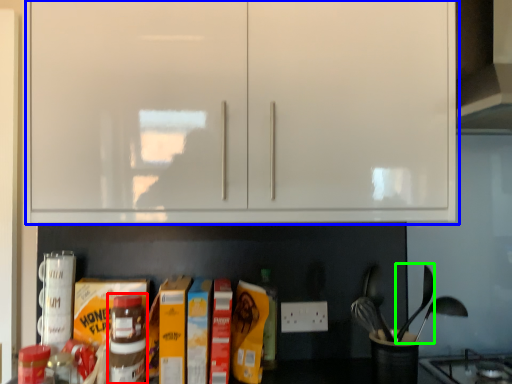
Question: Which object is the farthest from bottle (highlighted by a red box)? Choose among these: cabinetry (highlighted by a blue box) or silverware (highlighted by a green box).

Choices:
 (A) cabinetry
 (B) silverware

Answer: (B)